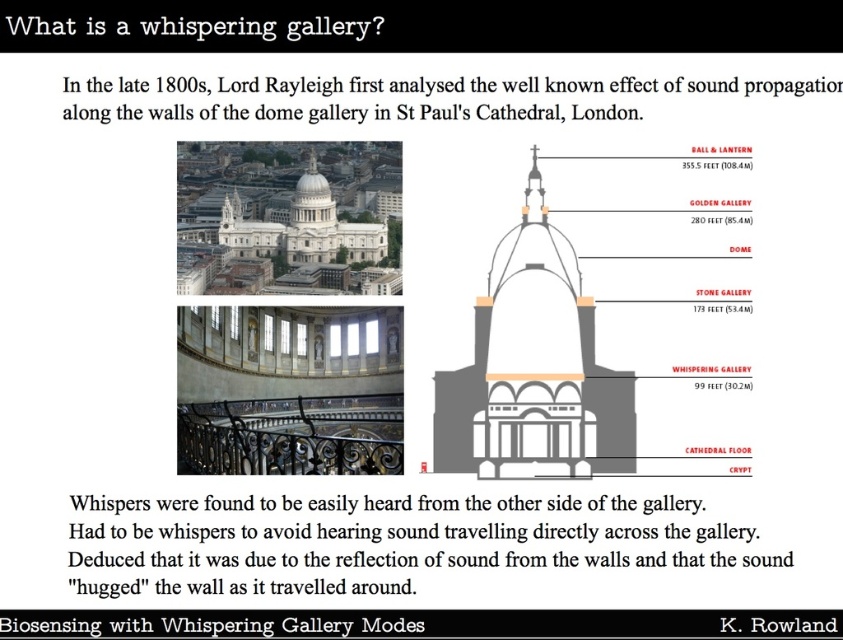
Based on the image of St Pauls Cathedral, which object is closer to the viewer the white stone dome at center or the white stone church at upper center?

The white stone dome at center is closer to the viewer than the white stone church at upper center.

You are standing in the middle of the image and want to look up at the tallest structure between the white stone dome at center and the white stone church at upper center. Which one should you look at?

The white stone church at upper center is taller than the white stone dome at center, so you should look at the white stone church at upper center.